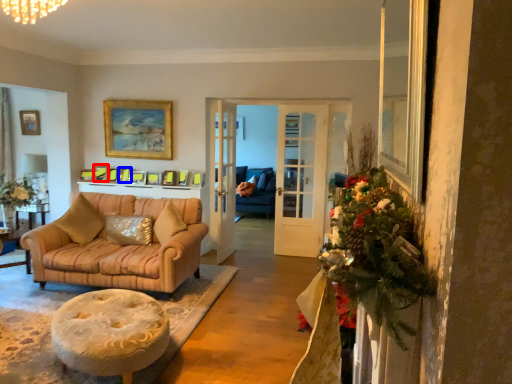
Question: Which object is closer to the camera taking this photo, picture frame (highlighted by a red box) or picture frame (highlighted by a blue box)?

Choices:
 (A) picture frame
 (B) picture frame

Answer: (B)